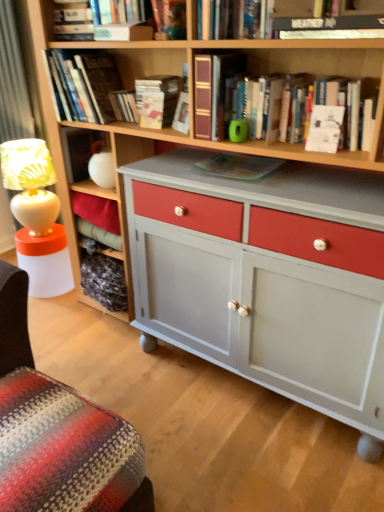
Question: Is there a large distance between hardcover book at upper center, the 6th book when ordered from left to right, and matte paper book at upper center, acting as the 4th book starting from the right?

Choices:
 (A) no
 (B) yes

Answer: (A)

Question: Does hardcover book at upper center, the 2th book in the right-to-left sequence, turn towards matte paper book at upper center, the fourth book when ordered from left to right?

Choices:
 (A) no
 (B) yes

Answer: (A)

Question: From the image's perspective, is hardcover book at upper center, the 2th book in the right-to-left sequence, under matte paper book at upper center, acting as the 4th book starting from the right?

Choices:
 (A) no
 (B) yes

Answer: (A)

Question: Is hardcover book at upper center, the 6th book when ordered from left to right, next to matte paper book at upper center, the fourth book when ordered from left to right?

Choices:
 (A) no
 (B) yes

Answer: (A)

Question: Considering the relative sizes of hardcover book at upper center, the 6th book when ordered from left to right, and matte paper book at upper center, acting as the 4th book starting from the right, in the image provided, is hardcover book at upper center, the 6th book when ordered from left to right, thinner than matte paper book at upper center, acting as the 4th book starting from the right,?

Choices:
 (A) yes
 (B) no

Answer: (B)

Question: Do you think leather-bound book at center, which appears as the 7th book when viewed from the left, is within white paper at upper center, the fourth paperback book in the left-to-right sequence, or outside of it?

Choices:
 (A) outside
 (B) inside

Answer: (A)

Question: Is point (221, 54) closer or farther from the camera than point (309, 148)?

Choices:
 (A) closer
 (B) farther

Answer: (B)

Question: In terms of width, does leather-bound book at center, positioned as the 1th book in right-to-left order, look wider or thinner when compared to white paper at upper center, the 1th paperback book viewed from the right?

Choices:
 (A) wide
 (B) thin

Answer: (A)

Question: In the image, is leather-bound book at center, which appears as the 7th book when viewed from the left, on the left side or the right side of white paper at upper center, the fourth paperback book in the left-to-right sequence?

Choices:
 (A) right
 (B) left

Answer: (B)

Question: Looking at their shapes, would you say matte green paperback book at center, the 3th paperback book from the left, is wider or thinner than leather-bound book at center, which appears as the 7th book when viewed from the left?

Choices:
 (A) thin
 (B) wide

Answer: (A)

Question: Relative to leather-bound book at center, which appears as the 7th book when viewed from the left, is matte green paperback book at center, the third paperback book in the back-to-front sequence, in front or behind?

Choices:
 (A) behind
 (B) front

Answer: (A)

Question: Would you say matte green paperback book at center, the third paperback book in the back-to-front sequence, is inside or outside leather-bound book at center, positioned as the 1th book in right-to-left order?

Choices:
 (A) outside
 (B) inside

Answer: (A)

Question: From a real-world perspective, is matte green paperback book at center, the third paperback book in the back-to-front sequence, positioned above or below leather-bound book at center, which appears as the 7th book when viewed from the left?

Choices:
 (A) above
 (B) below

Answer: (B)

Question: In terms of width, does hardcover book at upper center, which is counted as the 1th book, starting from the left, look wider or thinner when compared to matte green paperback book at center, positioned as the second paperback book in right-to-left order?

Choices:
 (A) thin
 (B) wide

Answer: (A)

Question: Choose the correct answer: Is hardcover book at upper center, the seventh book from the right, inside matte green paperback book at center, the third paperback book in the back-to-front sequence, or outside it?

Choices:
 (A) inside
 (B) outside

Answer: (B)